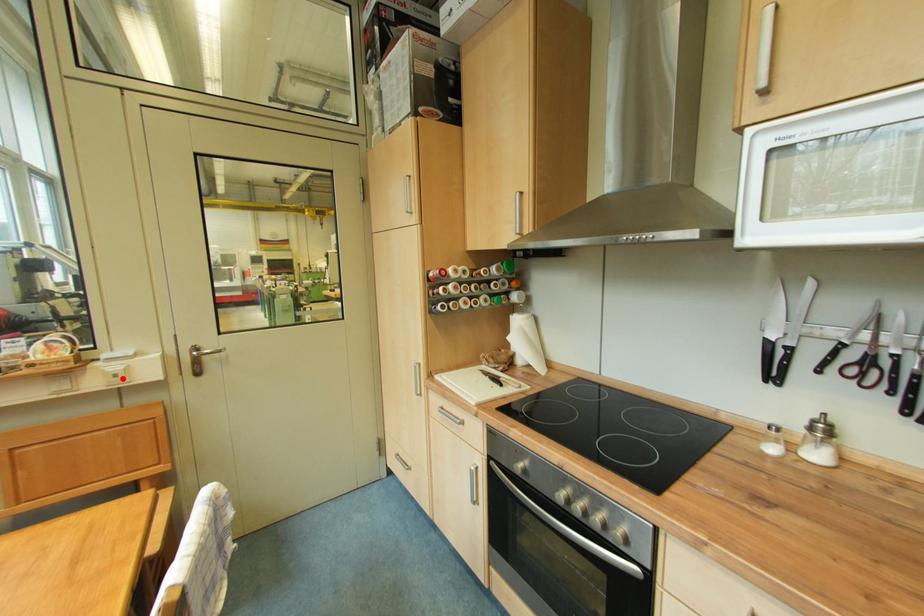
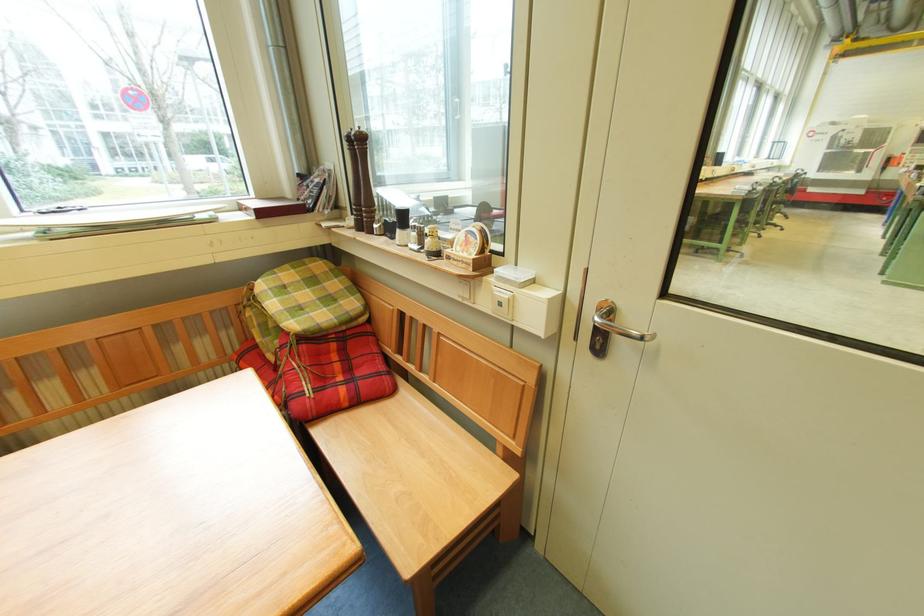
In the second image, find the point that corresponds to the highlighted location in the first image.

(507, 307)